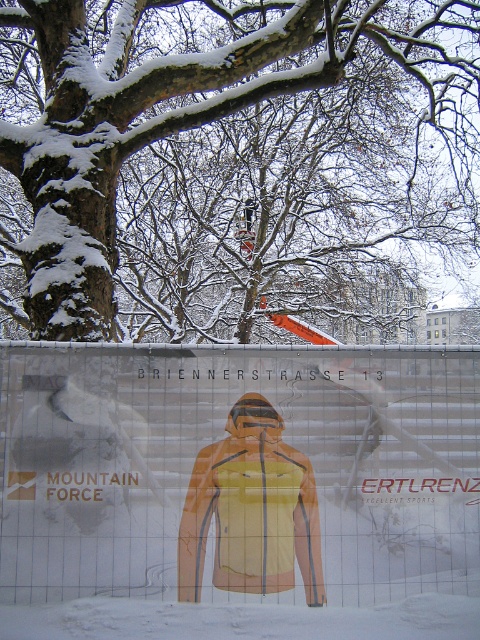
Question: Which object appears farthest from the camera in this image?

Choices:
 (A) transparent plastic at center
 (B) snow-covered bark at upper left

Answer: (B)

Question: Does snow-covered bark at upper left have a larger size compared to transparent plastic at center?

Choices:
 (A) yes
 (B) no

Answer: (A)

Question: Can you confirm if snow-covered bark at upper left is positioned to the left of transparent plastic at center?

Choices:
 (A) yes
 (B) no

Answer: (B)

Question: Can you confirm if snow-covered bark at upper left is bigger than transparent plastic at center?

Choices:
 (A) yes
 (B) no

Answer: (A)

Question: Which point is closer to the camera?

Choices:
 (A) (60, 54)
 (B) (194, 580)

Answer: (B)